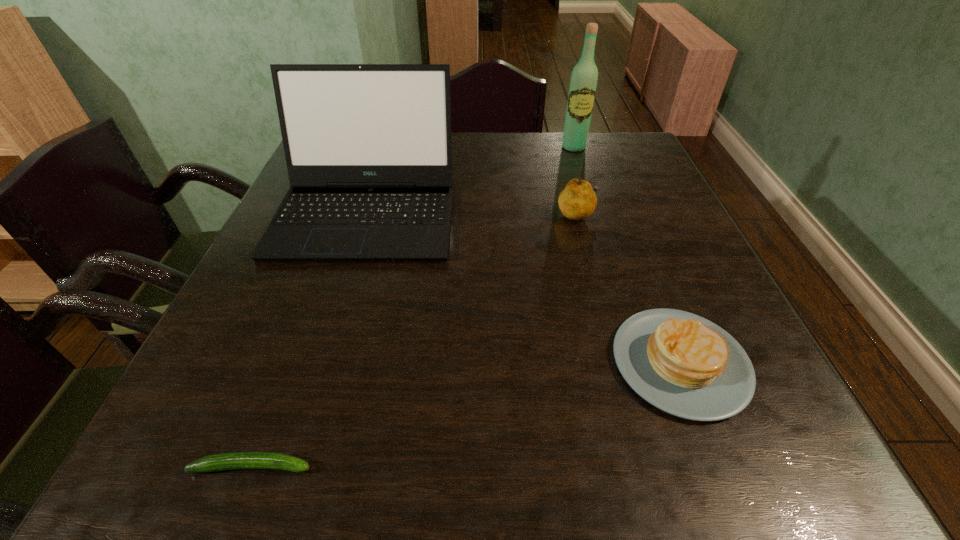
Locate an element on the screen. free space that is in between the laptop and the nearest object is located at coordinates (309, 339).

Locate an element on the screen. vacant space that's between the fourth shortest object and the farthest object is located at coordinates (470, 180).

The height and width of the screenshot is (540, 960). I want to click on free point between the nearest object and the laptop, so click(x=309, y=339).

The image size is (960, 540). Identify the location of empty space between the fourth shortest object and the third shortest object. (472, 213).

The image size is (960, 540). In order to click on vacant area between the zucchini and the third tallest object in this screenshot , I will do `click(415, 340)`.

At what (x,y) coordinates should I click in order to perform the action: click on empty location between the farthest object and the pancake. Please return your answer as a coordinate pair (x, y). Looking at the image, I should click on (627, 255).

The image size is (960, 540). I want to click on the third closest object to the fourth farthest object, so click(238, 460).

Identify which object is located as the third nearest to the fourth tallest object. Please provide its 2D coordinates. Your answer should be formatted as a tuple, i.e. [(x, y)], where the tuple contains the x and y coordinates of a point satisfying the conditions above.

[(238, 460)]

Identify the location of blank area in the image that satisfies the following two spatial constraints: 1. on the surface of the laptop; 2. on the left side of the fourth tallest object. Image resolution: width=960 pixels, height=540 pixels. 320,363.

The width and height of the screenshot is (960, 540). I want to click on free space that satisfies the following two spatial constraints: 1. on the front-facing side of the farthest object; 2. on the front-facing side of the zucchini, so click(x=674, y=466).